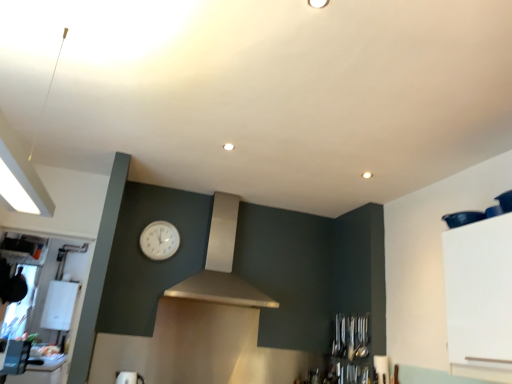
This screenshot has height=384, width=512. Find the location of `free point above white plastic clock at center (from a real-world perspective)`. free point above white plastic clock at center (from a real-world perspective) is located at coordinates (163, 216).